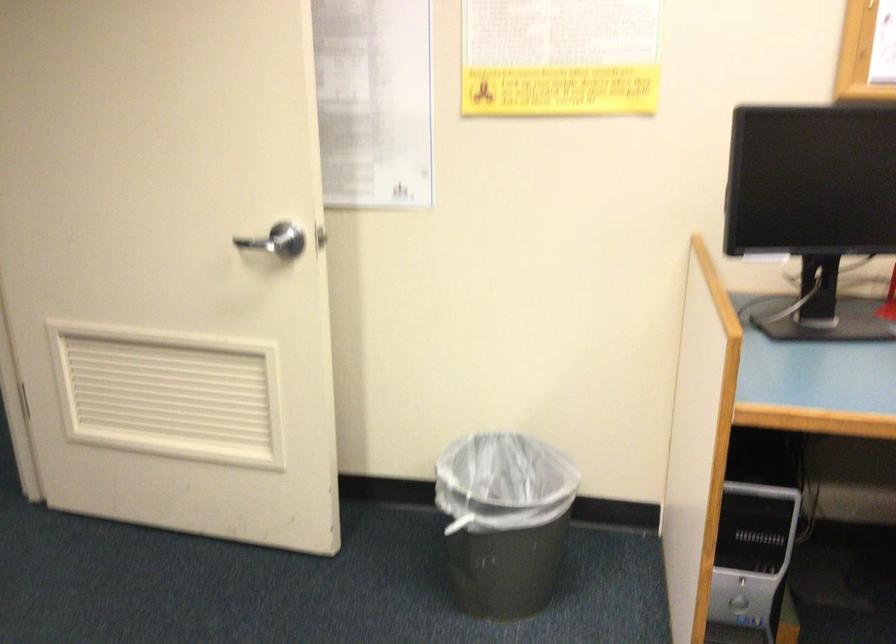
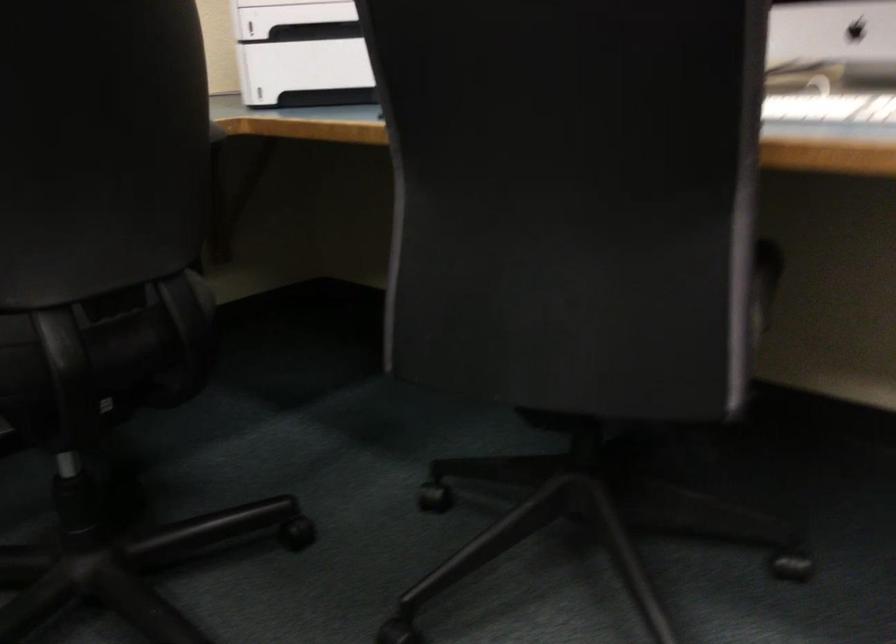
Question: Based on the continuous images, in which direction is the camera rotating? Reply with the corresponding letter.

Choices:
 (A) Left
 (B) Right
 (C) Up
 (D) Down

Answer: (B)